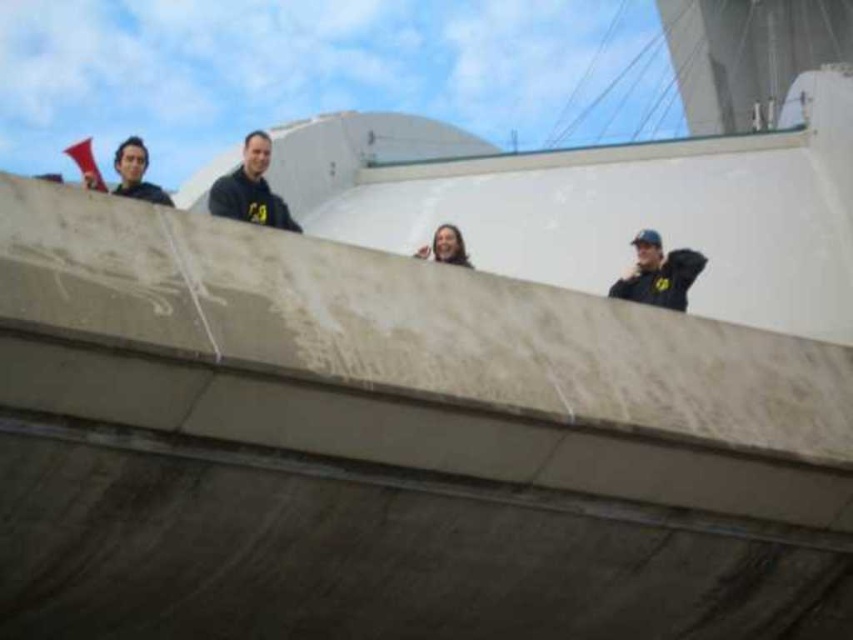
Question: Is black matte jacket at center wider than matte black shirt at upper left?

Choices:
 (A) yes
 (B) no

Answer: (B)

Question: Among these objects, which one is farthest from the camera?

Choices:
 (A) black matte jacket at center
 (B) matte black shirt at upper left
 (C) smooth skin face at center

Answer: (C)

Question: Observing the image, what is the correct spatial positioning of black matte jacket at center in reference to smooth skin face at center?

Choices:
 (A) right
 (B) left

Answer: (B)

Question: Does black matte jacket at center have a smaller size compared to smooth skin face at center?

Choices:
 (A) yes
 (B) no

Answer: (B)

Question: Which of the following is the farthest from the observer?

Choices:
 (A) matte black shirt at upper left
 (B) smooth skin face at center

Answer: (B)

Question: Considering the real-world distances, which object is closest to the matte black shirt at upper left?

Choices:
 (A) black matte jacket at center
 (B) black matte jacket at upper right
 (C) smooth skin face at center

Answer: (A)